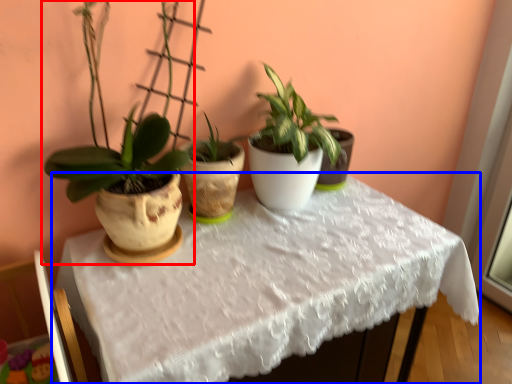
Question: Which object appears farthest to the camera in this image, houseplant (highlighted by a red box) or table (highlighted by a blue box)?

Choices:
 (A) houseplant
 (B) table

Answer: (B)